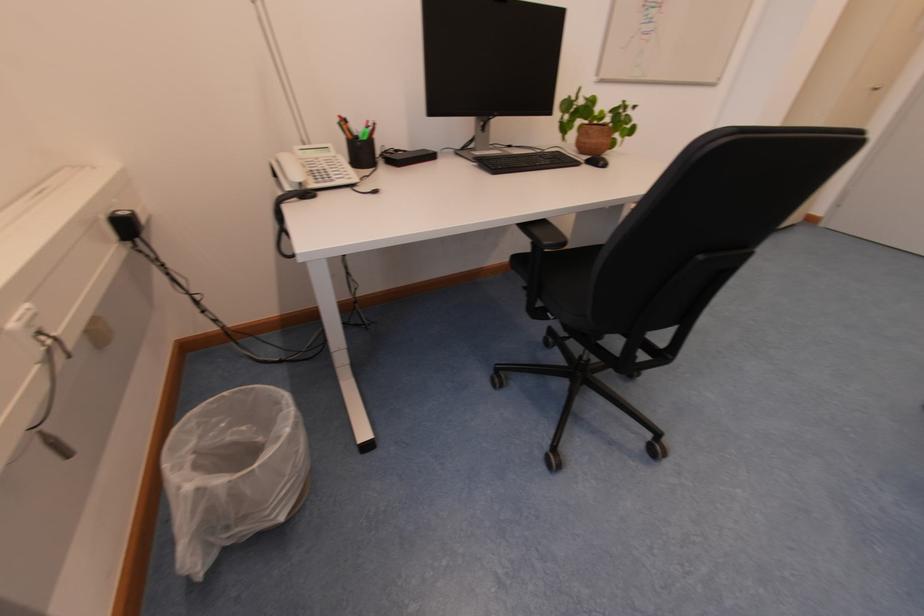
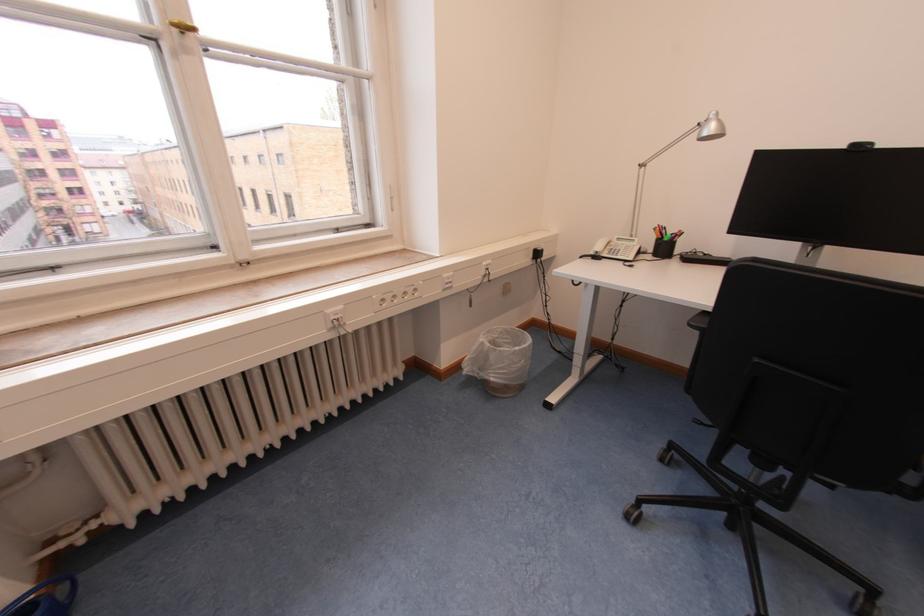
The point at (347, 120) is marked in the first image. Where is the corresponding point in the second image?

(665, 228)